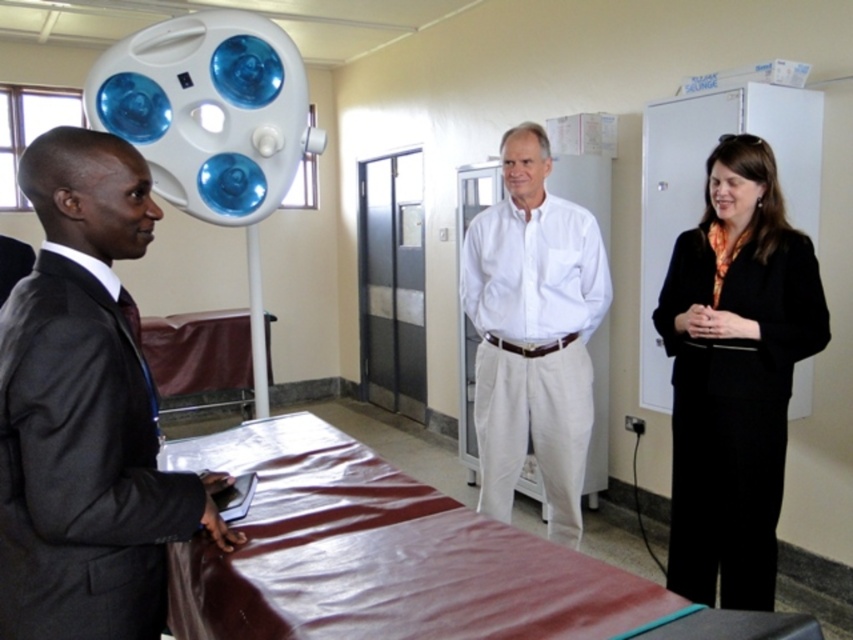
You are a tailor measuring suits for alterations. You have two suits in front of you, the dark gray suit at center and the black smooth suit at right. Which suit requires a wider alteration measurement?

The black smooth suit at right requires a wider alteration measurement since its width is greater than the dark gray suit at center.

You are a patient entering the clinic and notice two items at the center. Which item is positioned lower between the dark gray suit at center and the white cotton shirt at center?

The dark gray suit at center is positioned below the white cotton shirt at center, so the dark gray suit at center is lower.